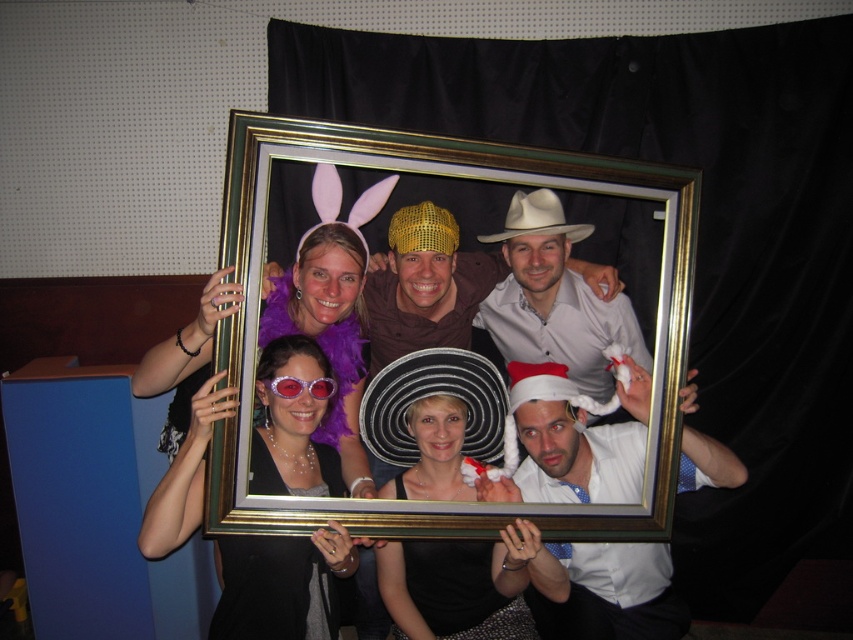
Who is taller, black satin hat at center or white matte cowboy hat at upper center?

black satin hat at center is taller.

Is black satin hat at center bigger than white matte cowboy hat at upper center?

Indeed, black satin hat at center has a larger size compared to white matte cowboy hat at upper center.

Is point (421, 464) closer to camera compared to point (529, 198)?

Yes, it is.

Locate an element on the screen. This screenshot has width=853, height=640. black satin hat at center is located at coordinates (434, 420).

From the picture: Is gold metallic picture frame at center to the right of purple shiny goggles at center from the viewer's perspective?

Yes, gold metallic picture frame at center is to the right of purple shiny goggles at center.

Does point (390, 506) come in front of point (277, 380)?

Yes.

Locate an element on the screen. The height and width of the screenshot is (640, 853). gold metallic picture frame at center is located at coordinates (439, 177).

Is gold metallic picture frame at center in front of white satin santa hat at lower right?

Yes, it is in front of white satin santa hat at lower right.

Who is positioned more to the left, gold metallic picture frame at center or white satin santa hat at lower right?

gold metallic picture frame at center

Is point (399, 534) less distant than point (633, 376)?

Yes, it is.

The image size is (853, 640). Identify the location of gold metallic picture frame at center. (439, 177).